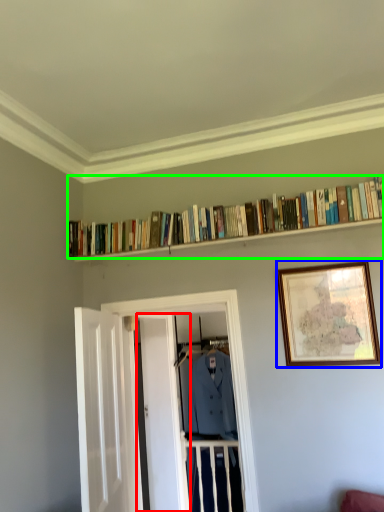
Question: Which object is the farthest from door (highlighted by a red box)? Choose among these: picture frame (highlighted by a blue box) or book (highlighted by a green box).

Choices:
 (A) picture frame
 (B) book

Answer: (A)